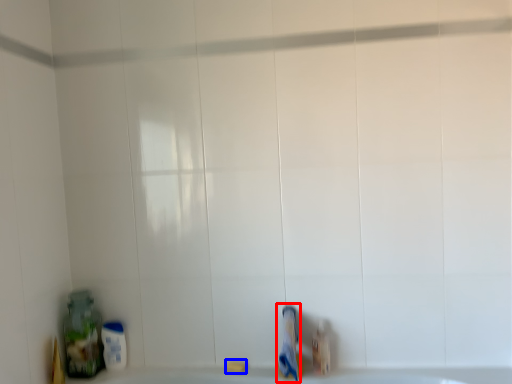
Question: Which object appears closest to the camera in this image, toothpaste (highlighted by a red box) or soap (highlighted by a blue box)?

Choices:
 (A) toothpaste
 (B) soap

Answer: (A)